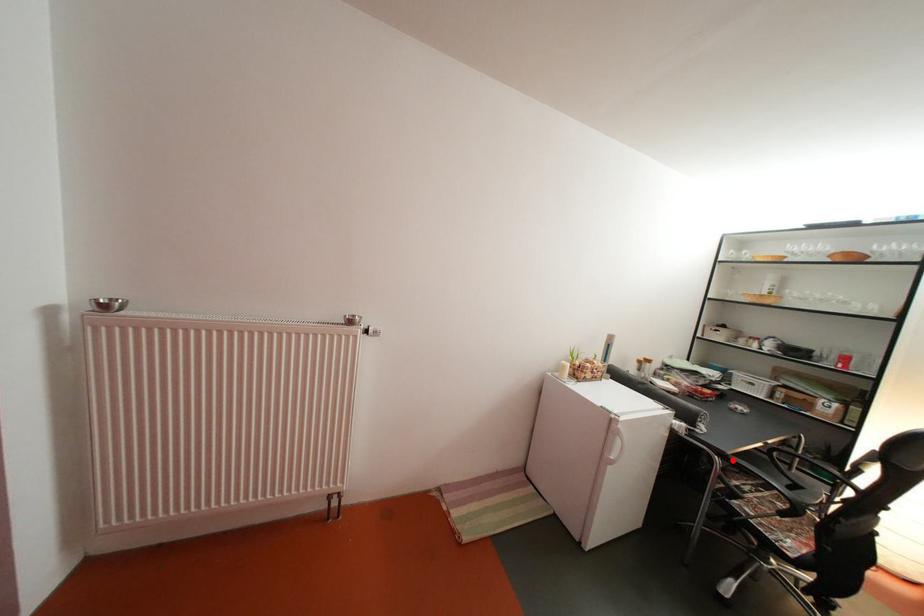
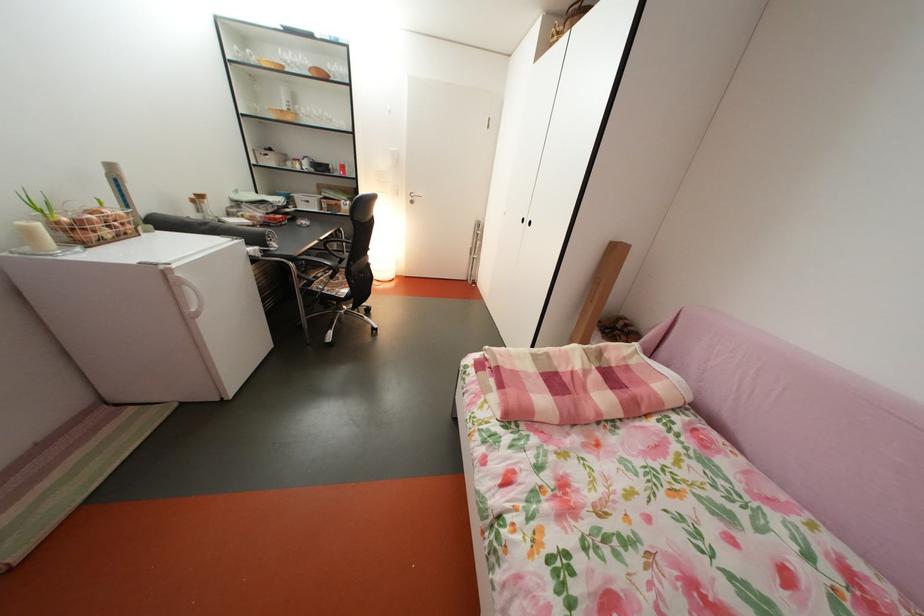
Where in the second image is the point corresponding to the highlighted location from the first image?

(304, 265)